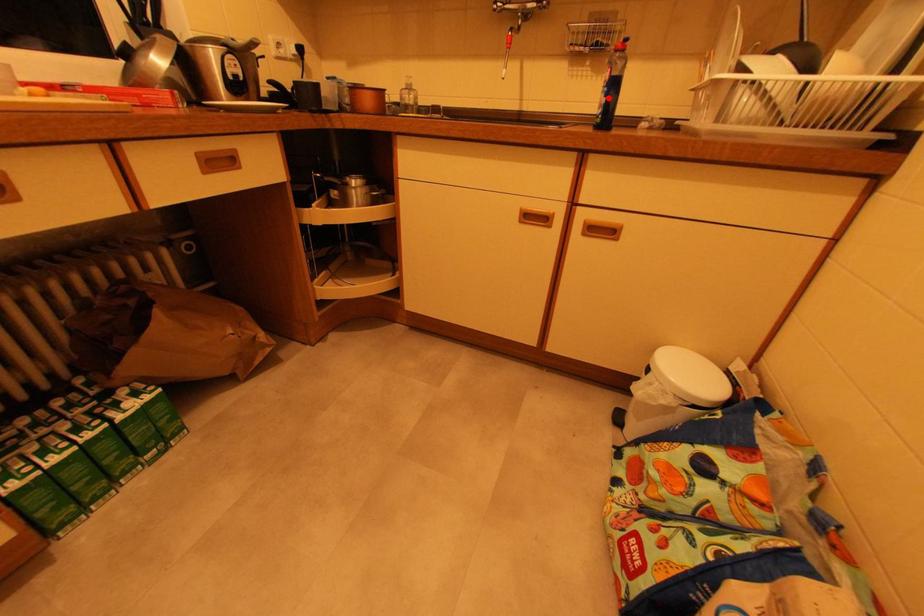
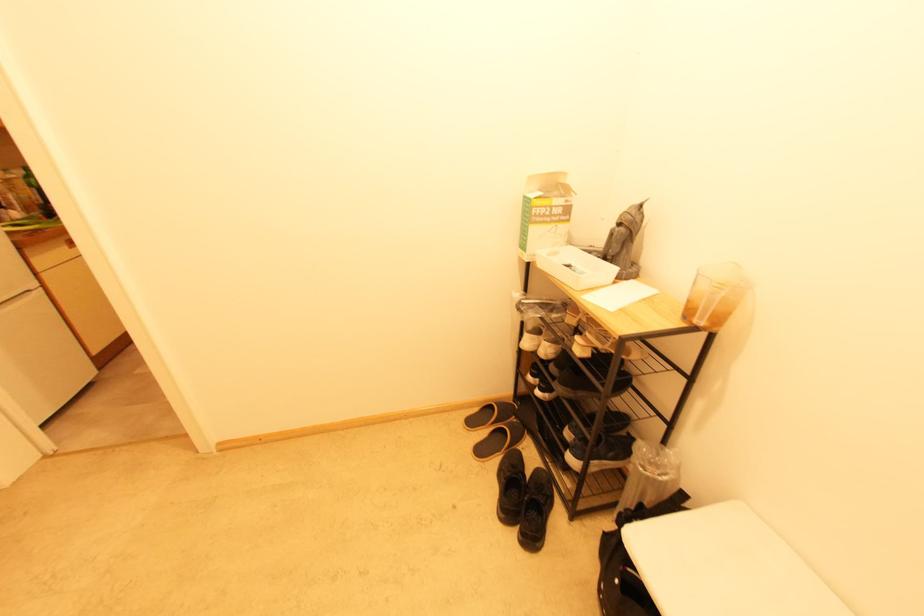
Question: I am providing you with two images of the same scene from different viewpoints. A red point is marked on the first image. Can you still see the location of the red point in image 2?

Choices:
 (A) Yes
 (B) No

Answer: (B)